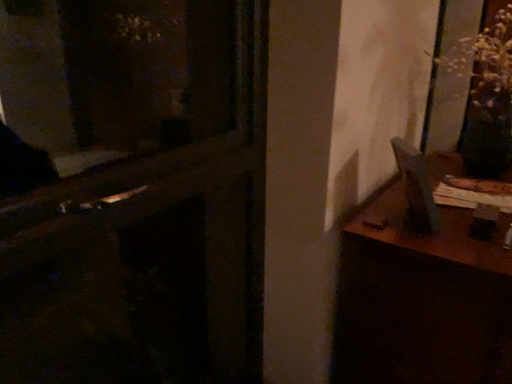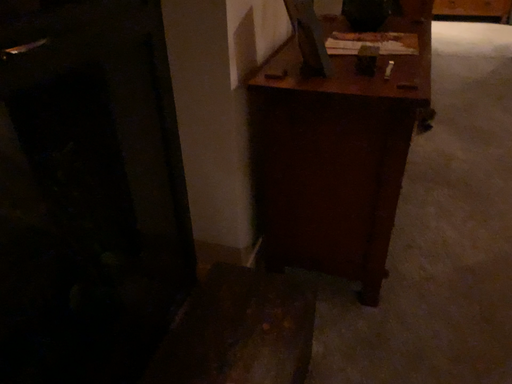
Question: How did the camera likely rotate when shooting the video?

Choices:
 (A) rotated right
 (B) rotated left

Answer: (A)